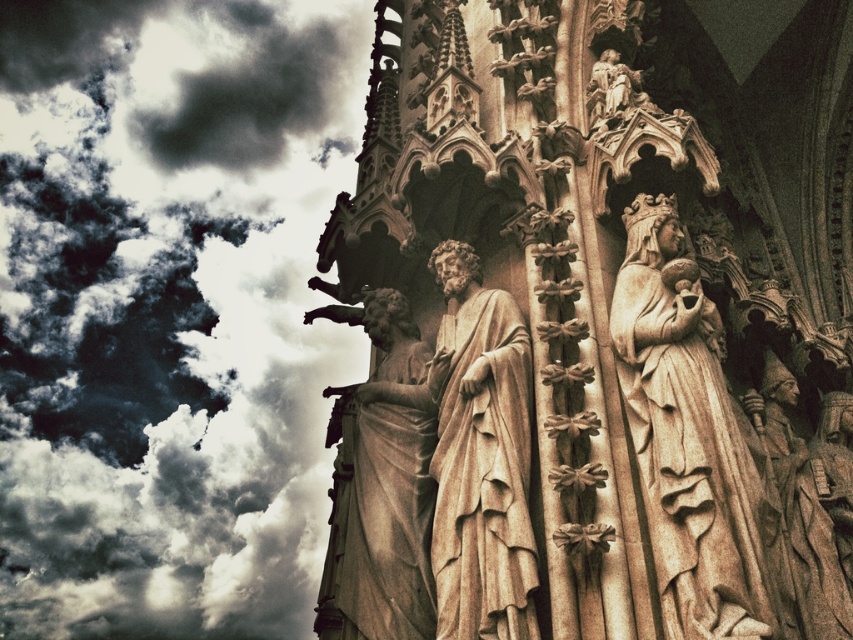
Is beige stone statue at right to the left of beige stone statue at center from the viewer's perspective?

Incorrect, beige stone statue at right is not on the left side of beige stone statue at center.

Between beige stone statue at right and beige stone statue at center, which one is positioned lower?

Positioned lower is beige stone statue at center.

Between point (734, 524) and point (506, 586), which one is positioned in front?

Point (506, 586) is in front.

This screenshot has width=853, height=640. In order to click on beige stone statue at right in this screenshot , I will do click(686, 435).

Can you confirm if beige stone statue at right is positioned to the right of smooth beige statue at center?

Yes, beige stone statue at right is to the right of smooth beige statue at center.

Is point (722, 632) behind point (344, 497)?

No, it is in front of (344, 497).

Measure the distance between beige stone statue at right and camera.

A distance of 54.40 meters exists between beige stone statue at right and camera.

Where is `beige stone statue at right`? beige stone statue at right is located at coordinates (686, 435).

Is dark gray cloud at upper left closer to camera compared to smooth beige statue at center?

No, dark gray cloud at upper left is behind smooth beige statue at center.

Can you confirm if dark gray cloud at upper left is positioned to the right of smooth beige statue at center?

No, dark gray cloud at upper left is not to the right of smooth beige statue at center.

This screenshot has height=640, width=853. What do you see at coordinates (169, 310) in the screenshot? I see `dark gray cloud at upper left` at bounding box center [169, 310].

Where is `dark gray cloud at upper left`? The width and height of the screenshot is (853, 640). dark gray cloud at upper left is located at coordinates (169, 310).